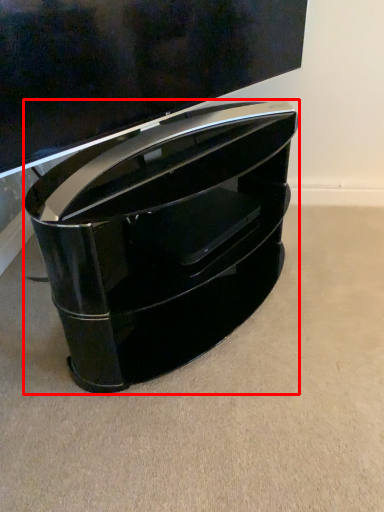
Question: From the image's perspective, what is the correct spatial positioning of furniture (annotated by the red box) in reference to television?

Choices:
 (A) below
 (B) above

Answer: (A)